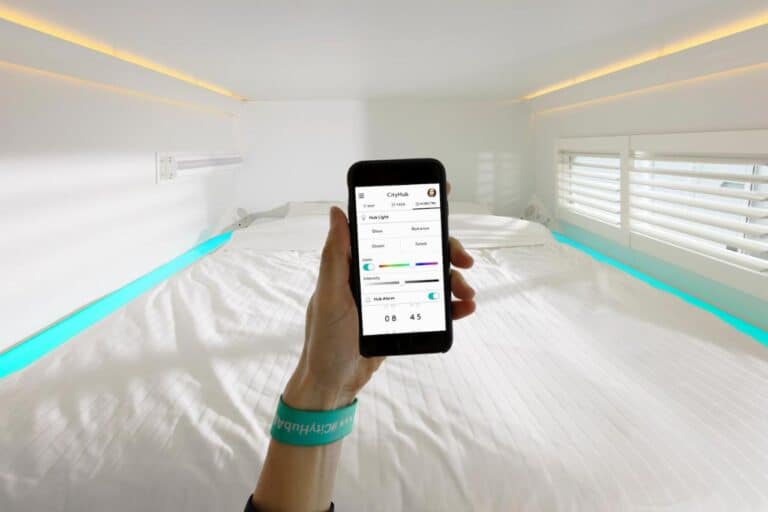
The image size is (768, 512). In order to click on ceiling in this screenshot , I will do pyautogui.click(x=336, y=9).